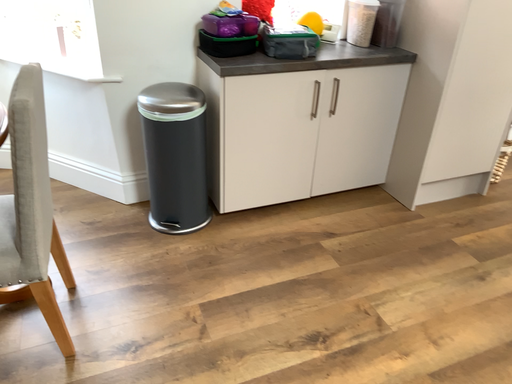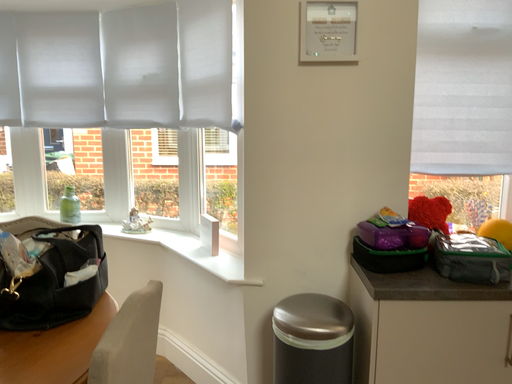
Question: Which way did the camera rotate in the video?

Choices:
 (A) rotated upward
 (B) rotated downward

Answer: (A)